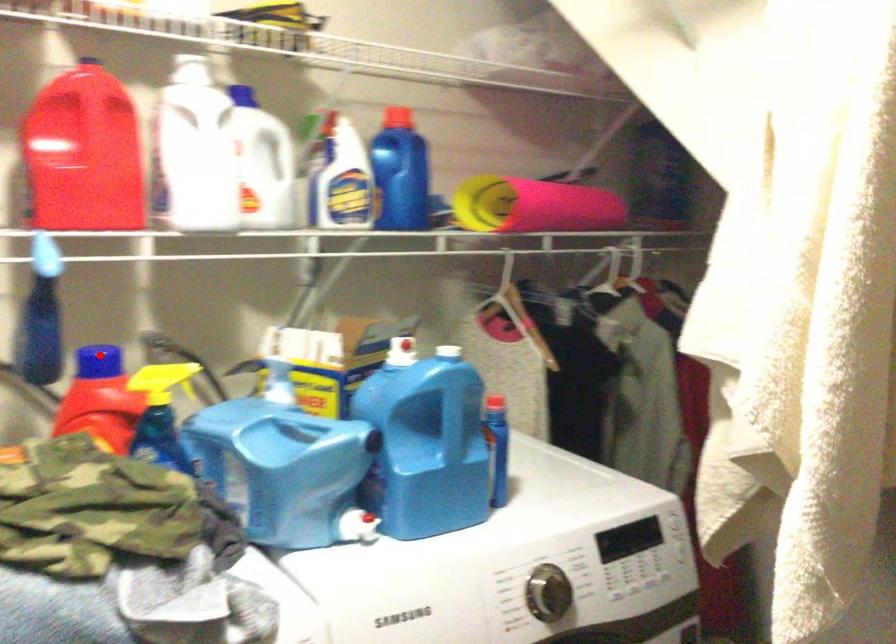
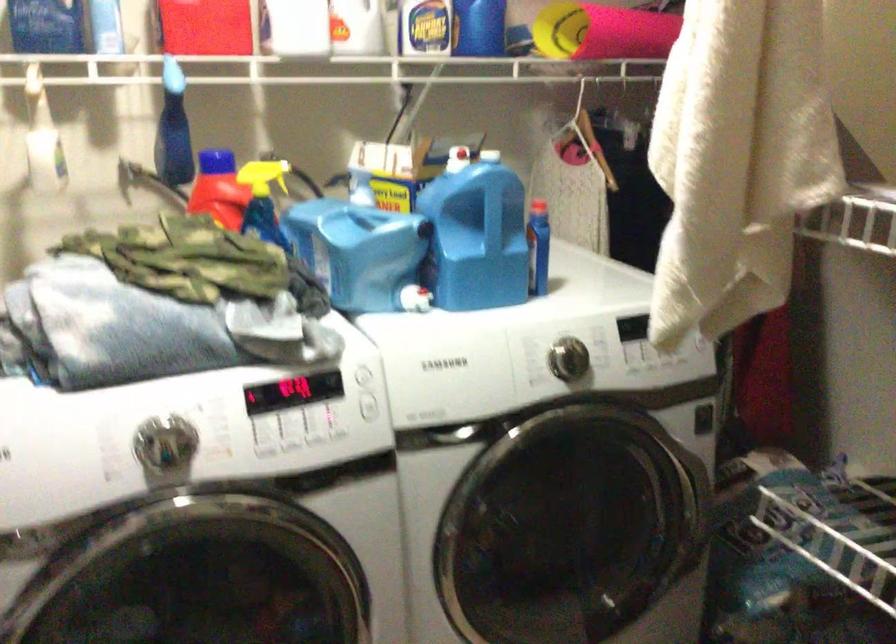
Question: I am providing you with two images of the same scene from different viewpoints. Given a red point in image1, look at the same physical point in image2. Is it:

Choices:
 (A) Closer to the viewpoint
 (B) Farther from the viewpoint

Answer: (B)